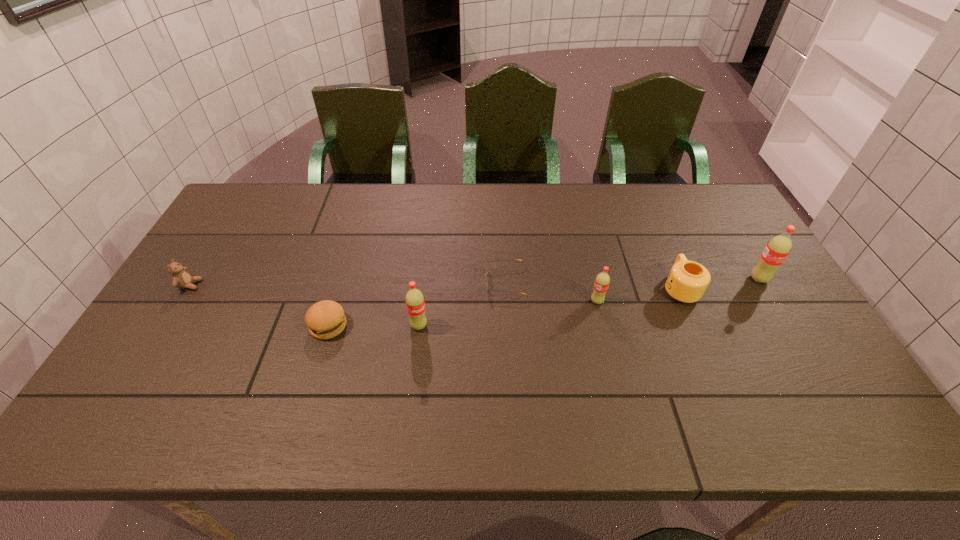
I want to click on the leftmost object, so click(181, 278).

Find the location of `the second object from right to left`. the second object from right to left is located at coordinates (x=687, y=281).

This screenshot has width=960, height=540. What are the coordinates of `vacant space located on the back of the second tallest object` in the screenshot? It's located at (429, 241).

Find the location of `vacant region located 0.390m on the back of the third object from right to left`. vacant region located 0.390m on the back of the third object from right to left is located at coordinates (575, 211).

This screenshot has height=540, width=960. I want to click on vacant point located on the left of the tallest object, so click(x=621, y=279).

Where is `vacant space situated on the temples of the fourth object from right to left`? This screenshot has width=960, height=540. vacant space situated on the temples of the fourth object from right to left is located at coordinates (426, 282).

Locate an element on the screen. blank space located on the temples of the fourth object from right to left is located at coordinates (392, 282).

Find the location of a particular element. free location located 0.050m on the temples of the fourth object from right to left is located at coordinates tap(468, 282).

You are a GUI agent. You are given a task and a screenshot of the screen. Output one action in this format:
    pyautogui.click(x=<x>, y=<y>)
    Task: Click on the vacant space located on the left of the hamburger
    The height and width of the screenshot is (540, 960).
    Given the screenshot: What is the action you would take?
    pyautogui.click(x=227, y=326)

Where is `vacant region located on the front-facing side of the leftmost object`? The image size is (960, 540). vacant region located on the front-facing side of the leftmost object is located at coordinates (316, 285).